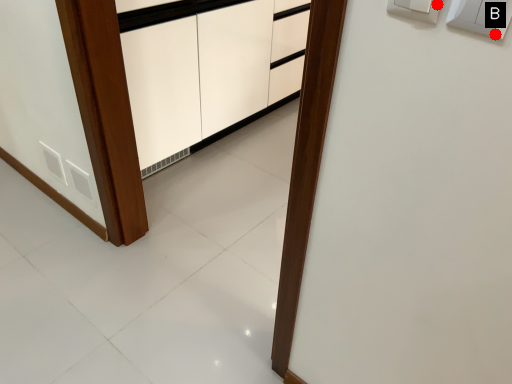
Question: Two points are circled on the image, labeled by A and B beside each circle. Which point is farther from the camera taking this photo?

Choices:
 (A) A is further
 (B) B is further

Answer: (A)